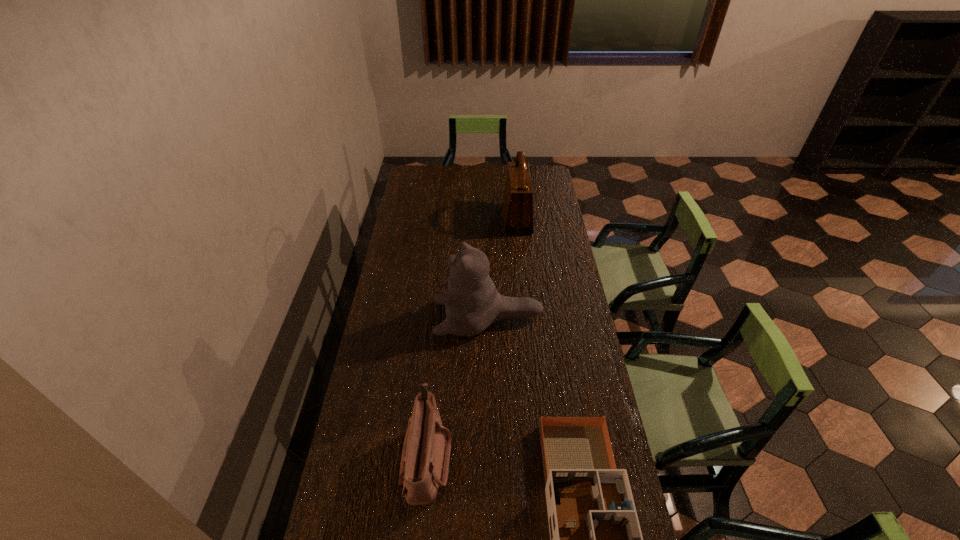
This screenshot has width=960, height=540. I want to click on free spot located on the face of the second farthest object, so click(x=409, y=318).

The width and height of the screenshot is (960, 540). In order to click on free space located 0.180m on the front pocket of the left shoulder bag in this screenshot , I will do `click(512, 458)`.

Find the location of `object located in the right edge section of the desktop`. object located in the right edge section of the desktop is located at coordinates (517, 212).

Image resolution: width=960 pixels, height=540 pixels. In order to click on blank space at the far edge in this screenshot , I will do `click(476, 165)`.

Where is `free space at the left edge of the desktop`? This screenshot has width=960, height=540. free space at the left edge of the desktop is located at coordinates (388, 440).

In the image, there is a desktop. At what (x,y) coordinates should I click in order to perform the action: click on free space at the right edge. Please return your answer as a coordinate pair (x, y). The height and width of the screenshot is (540, 960). Looking at the image, I should click on (560, 360).

Locate an element on the screen. This screenshot has width=960, height=540. free space at the far left corner of the desktop is located at coordinates (428, 170).

This screenshot has height=540, width=960. What are the coordinates of `empty space that is in between the taller shoulder bag and the cat` in the screenshot? It's located at (502, 268).

The image size is (960, 540). Find the location of `vacant area that lies between the right shoulder bag and the left shoulder bag`. vacant area that lies between the right shoulder bag and the left shoulder bag is located at coordinates (471, 339).

Locate an element on the screen. This screenshot has height=540, width=960. blank region between the farthest object and the second farthest object is located at coordinates (502, 268).